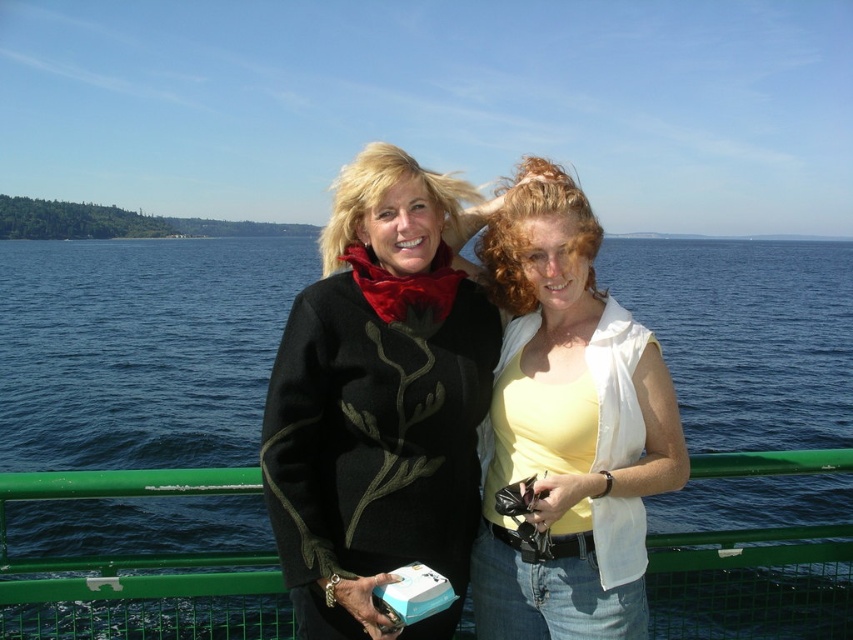
You are a photographer trying to capture a photo of the black woolen sweater at center and the green metal railing at center. The camera you are using has a minimum focusing distance of 10 meters. Will you be able to take a clear photo of both objects at the same time?

The black woolen sweater at center and the green metal railing at center are 9.23 meters apart from each other. Since the minimum focusing distance of the camera is 10 meters, the photographer cannot take a clear photo of both objects at the same time because the distance is shorter than the required minimum focusing distance.